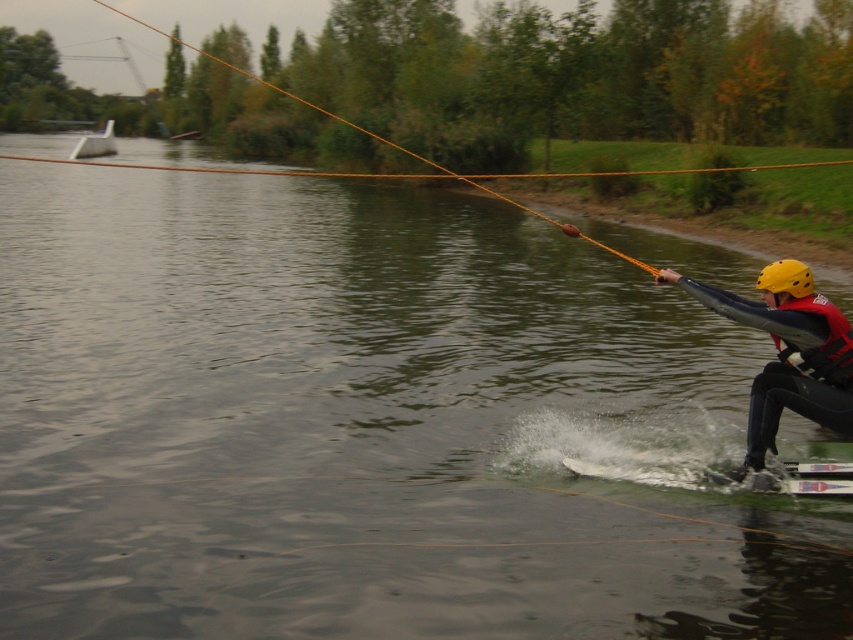
Question: Which object is closer to the camera taking this photo?

Choices:
 (A) black matte wetsuit at lower right
 (B) white plastic boat at upper left
 (C) orange rope at upper center
 (D) red matte life jacket at right

Answer: (A)

Question: Which point is closer to the camera?

Choices:
 (A) (521, 209)
 (B) (695, 296)
 (C) (94, 147)
 (D) (840, 336)

Answer: (D)

Question: From the image, what is the correct spatial relationship of orange rope at upper center in relation to white plastic boat at upper left?

Choices:
 (A) below
 (B) above

Answer: (B)

Question: Can you confirm if orange rope at upper center is wider than white plastic boat at upper left?

Choices:
 (A) no
 (B) yes

Answer: (B)

Question: Observing the image, what is the correct spatial positioning of red matte life jacket at right in reference to orange rope at upper center?

Choices:
 (A) above
 (B) below

Answer: (B)

Question: Estimate the real-world distances between objects in this image. Which object is closer to the white plastic boat at upper left?

Choices:
 (A) red matte life jacket at right
 (B) black matte wetsuit at lower right
 (C) orange rope at upper center

Answer: (C)